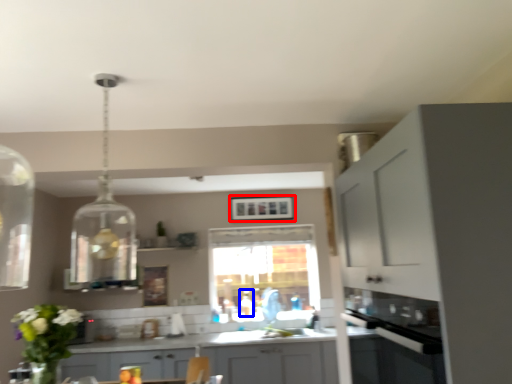
Question: Which object is closer to the camera taking this photo, picture frame (highlighted by a red box) or bottle (highlighted by a blue box)?

Choices:
 (A) picture frame
 (B) bottle

Answer: (B)